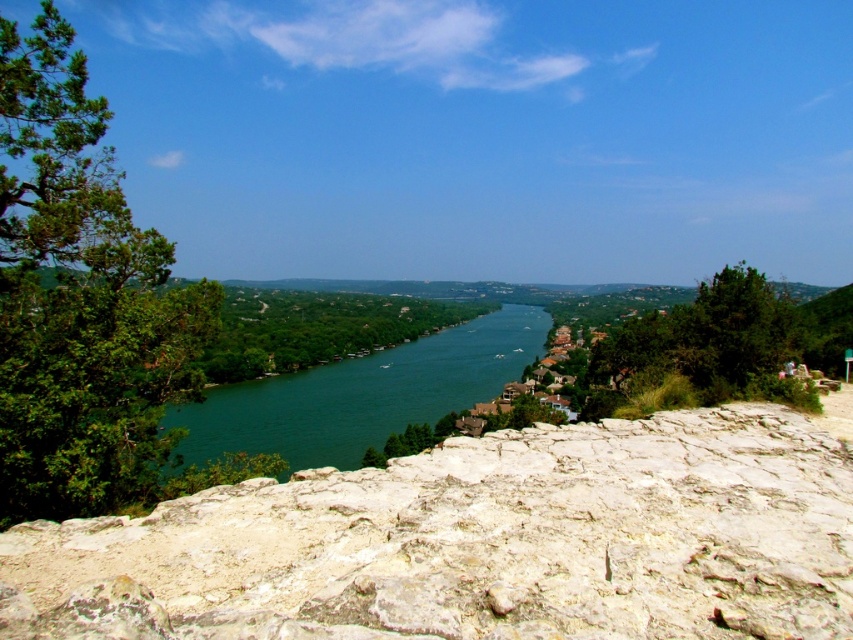
Consider the image. You are a hiker who wants to take a photo of the white rocky cliff at center from the best possible angle. According to the coordinates provided, where should you position yourself relative to the cliff to capture it in the frame?

The white rocky cliff at center is located at coordinates point (477, 541), so positioning yourself directly in front of it at that point will allow you to capture it in the frame.